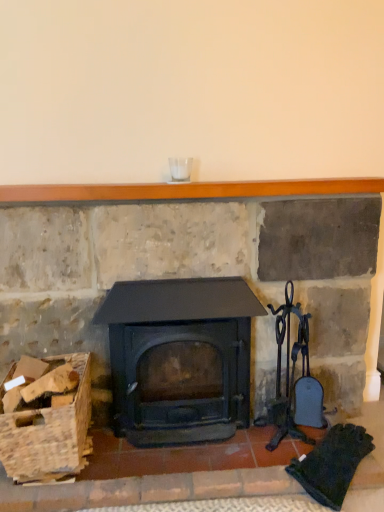
Question: Is wooden mantlepiece at upper center thinner than matte black wood burning stove at center?

Choices:
 (A) no
 (B) yes

Answer: (B)

Question: Considering the relative positions of wooden mantlepiece at upper center and matte black wood burning stove at center in the image provided, is wooden mantlepiece at upper center in front of matte black wood burning stove at center?

Choices:
 (A) no
 (B) yes

Answer: (A)

Question: Is wooden mantlepiece at upper center further to the viewer compared to matte black wood burning stove at center?

Choices:
 (A) yes
 (B) no

Answer: (A)

Question: Is wooden mantlepiece at upper center not near matte black wood burning stove at center?

Choices:
 (A) yes
 (B) no

Answer: (B)

Question: Considering the relative sizes of wooden mantlepiece at upper center and matte black wood burning stove at center in the image provided, is wooden mantlepiece at upper center shorter than matte black wood burning stove at center?

Choices:
 (A) yes
 (B) no

Answer: (A)

Question: From the image's perspective, is wooden mantlepiece at upper center beneath matte black wood burning stove at center?

Choices:
 (A) yes
 (B) no

Answer: (B)

Question: Are wooden crate at lower left and wooden mantlepiece at upper center making contact?

Choices:
 (A) yes
 (B) no

Answer: (B)

Question: Is wooden crate at lower left oriented towards wooden mantlepiece at upper center?

Choices:
 (A) no
 (B) yes

Answer: (A)

Question: Does wooden crate at lower left have a larger size compared to wooden mantlepiece at upper center?

Choices:
 (A) yes
 (B) no

Answer: (A)

Question: From a real-world perspective, is wooden crate at lower left under wooden mantlepiece at upper center?

Choices:
 (A) no
 (B) yes

Answer: (B)

Question: Considering the relative sizes of wooden crate at lower left and wooden mantlepiece at upper center in the image provided, is wooden crate at lower left smaller than wooden mantlepiece at upper center?

Choices:
 (A) no
 (B) yes

Answer: (A)

Question: Can you confirm if wooden crate at lower left is positioned to the right of wooden mantlepiece at upper center?

Choices:
 (A) no
 (B) yes

Answer: (A)

Question: From the image's perspective, does matte black wood burning stove at center appear lower than wooden crate at lower left?

Choices:
 (A) yes
 (B) no

Answer: (B)